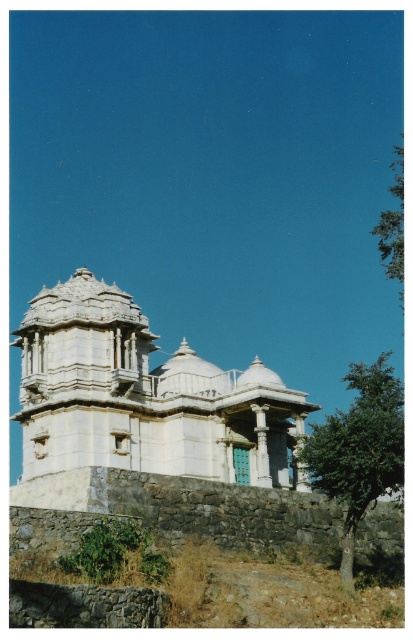
Is green leafy tree at lower right further to camera compared to green leafy tree at upper right?

No.

In order to click on green leafy tree at lower right in this screenshot , I will do 360,449.

This screenshot has height=640, width=413. I want to click on green leafy tree at lower right, so click(360, 449).

Between white stone palace at center and green leafy tree at upper right, which one appears on the right side from the viewer's perspective?

green leafy tree at upper right

Is white stone palace at center wider than green leafy tree at upper right?

Incorrect, white stone palace at center's width does not surpass green leafy tree at upper right's.

What do you see at coordinates (142, 396) in the screenshot?
I see `white stone palace at center` at bounding box center [142, 396].

At what (x,y) coordinates should I click in order to perform the action: click on white stone palace at center. Please return your answer as a coordinate pair (x, y). Looking at the image, I should click on (142, 396).

Is white stone palace at center thinner than green leafy tree at lower right?

Yes.

Identify the location of white stone palace at center. Image resolution: width=413 pixels, height=640 pixels. (142, 396).

Does point (87, 288) come behind point (386, 356)?

No.

Where is `white stone palace at center`? The width and height of the screenshot is (413, 640). white stone palace at center is located at coordinates (142, 396).